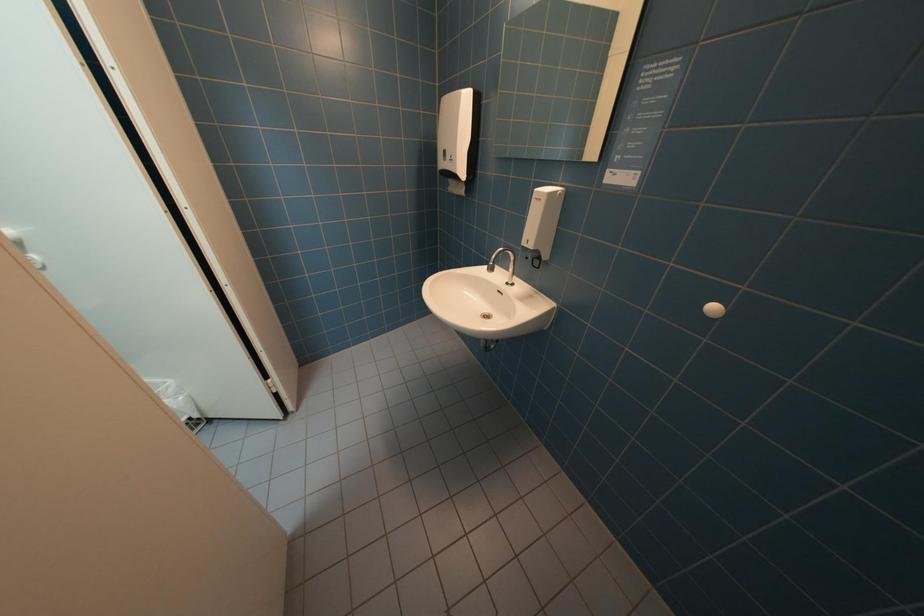
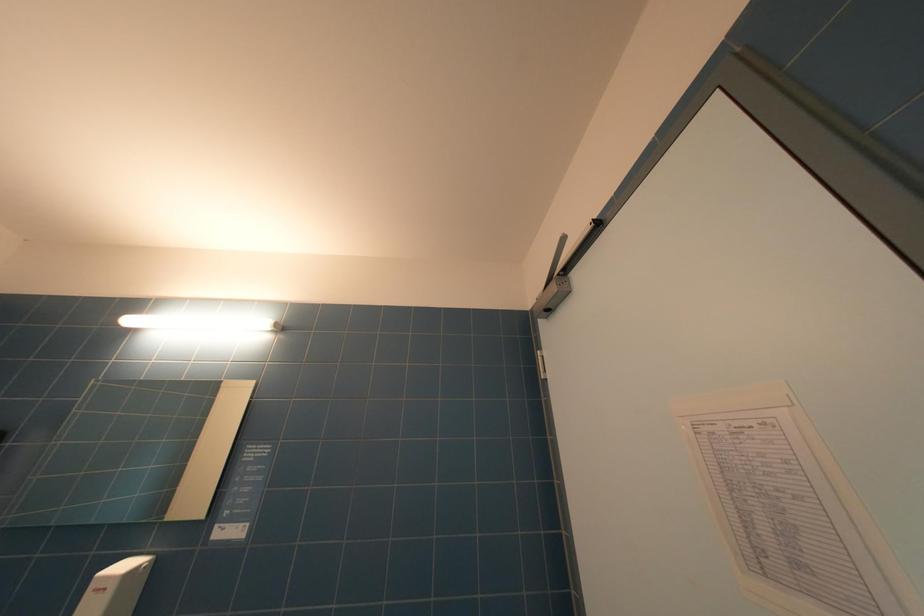
First-person continuous shooting, in which direction is the camera rotating?

The rotation direction of the camera is right-up.